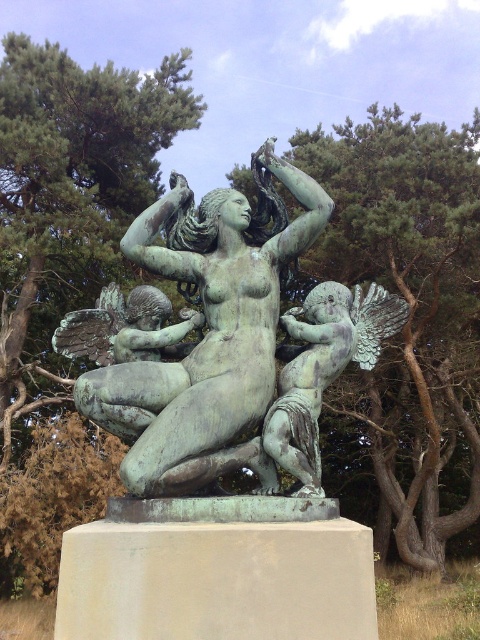
You are an art student analyzing the spatial arrangement of the sculpture and its surroundings. The sculpture is in the center of the image. You need to determine the exact coordinates of the green textured tree at upper left to include in your report. What are its coordinates?

The green textured tree at upper left is located at coordinates point [71,196].

You are standing in front of the bronze sculpture and want to take a photo of the green textured tree at center. Where should you position yourself relative to the sculpture to capture the tree in the frame?

Position yourself directly in front of the bronze sculpture, as the green textured tree at center is located at the central point in the image, specifically at coordinates 0.508 on the horizontal axis and 0.846 on the vertical axis. This central positioning ensures the tree will be in the frame when photographing from the front.

You are standing in front of the bronze sculpture. There are two points marked on the sculpture. One is at coordinate point (373, 484) and the other is at point (107, 124). Which point is closer to you?

Point (373, 484) is further to the viewer than point (107, 124), so the point at (107, 124) is closer to you.